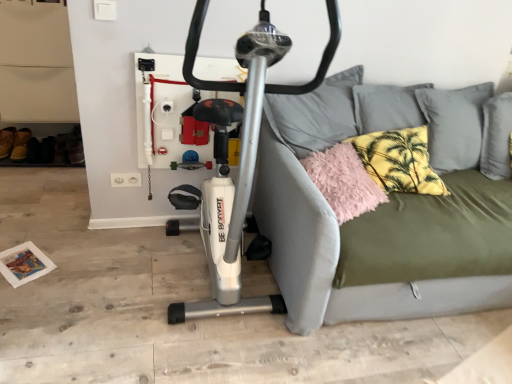
Question: From a real-world perspective, relative to brown suede shoe at lower left, is olive green fabric studio couch at center vertically above or below?

Choices:
 (A) below
 (B) above

Answer: (B)

Question: Is olive green fabric studio couch at center inside the boundaries of brown suede shoe at lower left, or outside?

Choices:
 (A) inside
 (B) outside

Answer: (B)

Question: Which is farther from the olive green fabric studio couch at center?

Choices:
 (A) brown suede shoe at lower left
 (B) yellow palm-patterned pillow at upper right, the 2th pillow in the left-to-right sequence
 (C) fluffy pink pillow at right, the second pillow viewed from the right
 (D) silver metallic stationary bicycle at center

Answer: (A)

Question: Which is farther from the yellow palm-patterned pillow at upper right, the 1th pillow viewed from the right?

Choices:
 (A) fluffy pink pillow at right, the second pillow viewed from the right
 (B) brown suede shoe at lower left
 (C) silver metallic stationary bicycle at center
 (D) olive green fabric studio couch at center

Answer: (B)